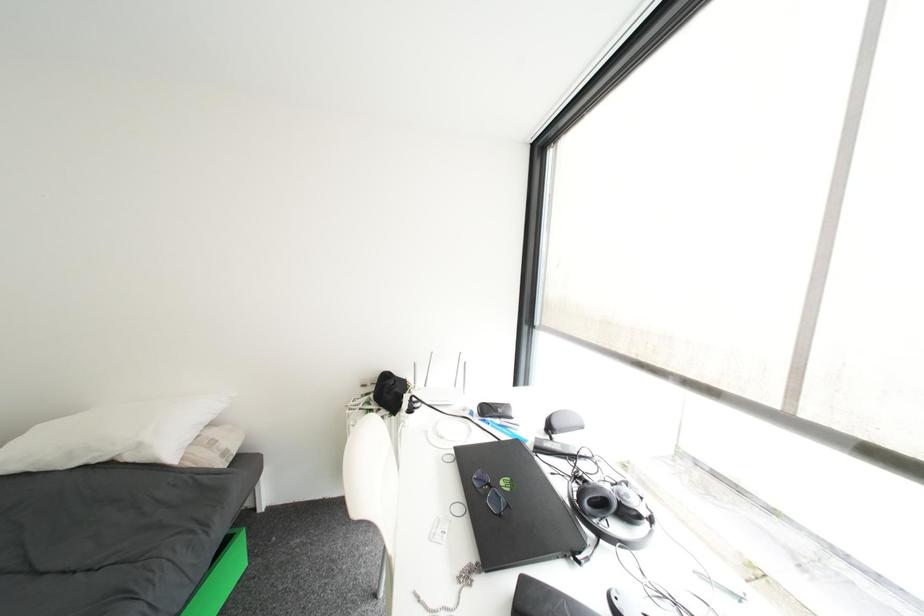
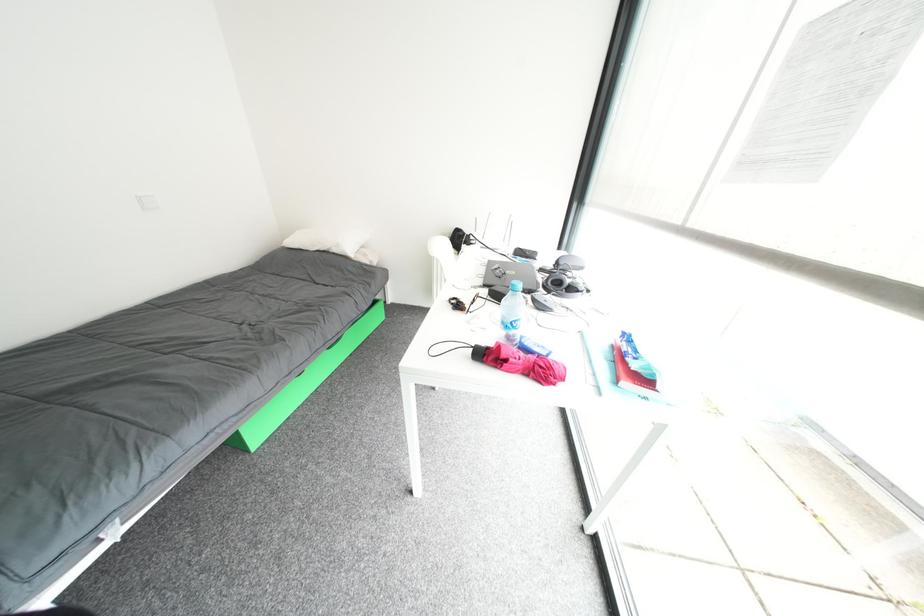
First-person continuous shooting, in which direction is the camera rotating?

The camera rotated toward left-down.